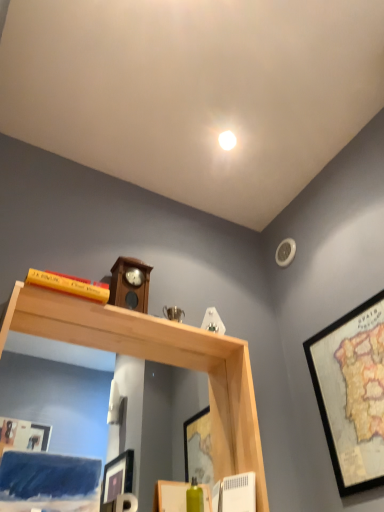
Question: Based on their positions, is wooden framed map at right located to the left or right of yellow matte bookshelf at upper left?

Choices:
 (A) left
 (B) right

Answer: (B)

Question: Considering their positions, is wooden framed map at right located in front of or behind yellow matte bookshelf at upper left?

Choices:
 (A) behind
 (B) front

Answer: (B)

Question: Which object is the closest to the yellow matte bookshelf at upper left?

Choices:
 (A) wooden clock at center
 (B) wooden framed map at right
 (C) natural wood mirror at upper center

Answer: (A)

Question: Estimate the real-world distances between objects in this image. Which object is closer to the wooden clock at center?

Choices:
 (A) wooden framed map at right
 (B) natural wood mirror at upper center
 (C) yellow matte bookshelf at upper left

Answer: (C)